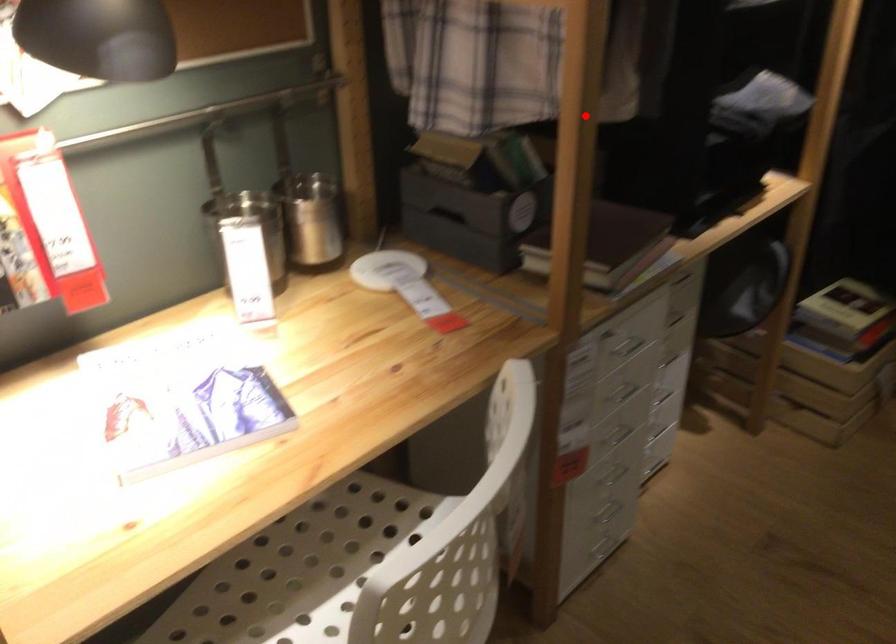
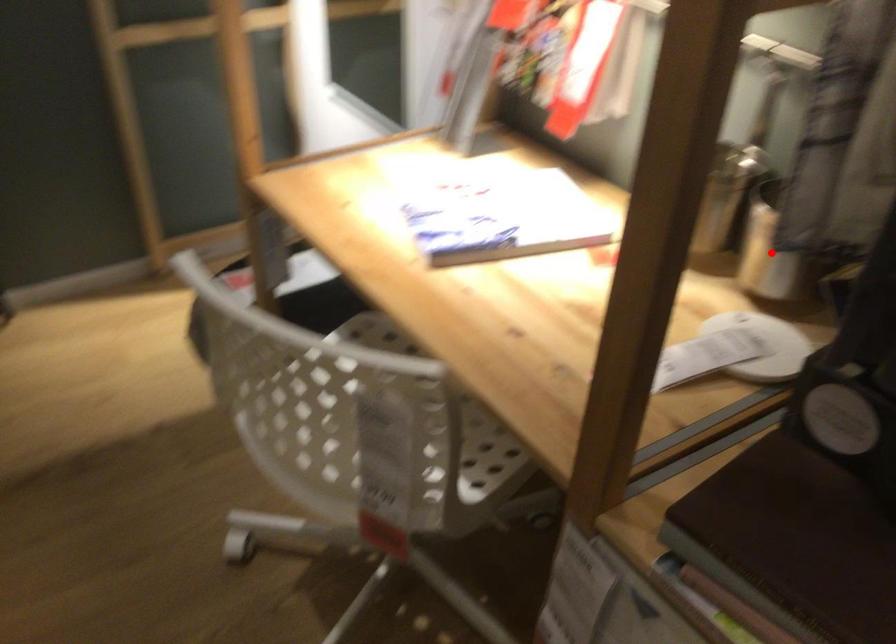
I am providing you with two images of the same scene from different viewpoints. A red point is marked on the first image and another point is marked on the second image. Is the marked point in image1 the same physical position as the marked point in image2?

Yes